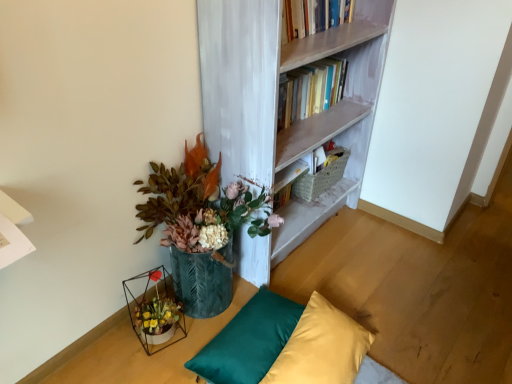
The width and height of the screenshot is (512, 384). I want to click on vacant space to the right of metallic wire table at lower left, so click(159, 342).